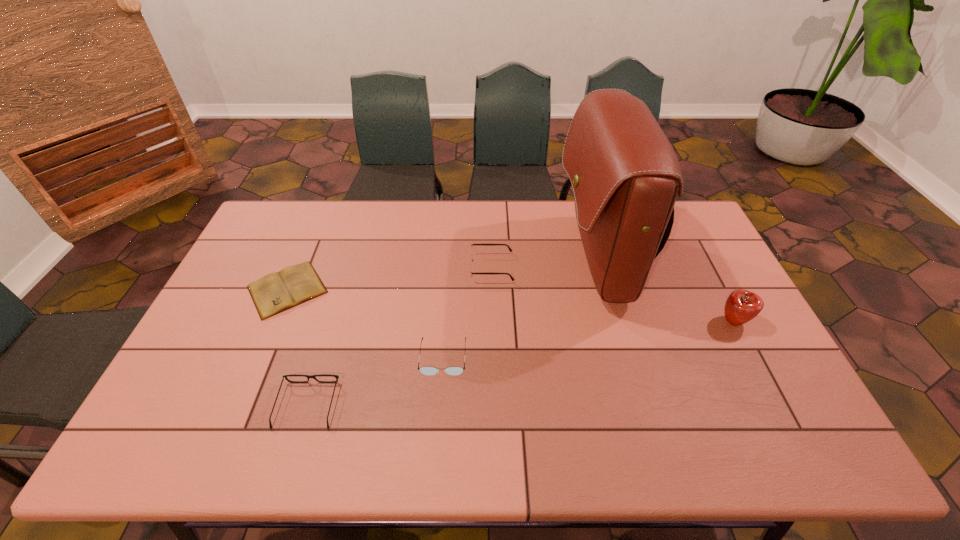
The width and height of the screenshot is (960, 540). I want to click on the shortest object, so click(x=293, y=285).

Image resolution: width=960 pixels, height=540 pixels. Identify the location of free space located 0.190m on the open flap of the tallest object. (501, 260).

At what (x,y) coordinates should I click in order to perform the action: click on free space located 0.150m on the open flap of the tallest object. Please return your answer as a coordinate pair (x, y). Looking at the image, I should click on (514, 260).

Where is `blank space located on the open flap of the tallest object`? This screenshot has width=960, height=540. blank space located on the open flap of the tallest object is located at coordinates (492, 260).

The width and height of the screenshot is (960, 540). Find the location of `vacant space situated 0.320m on the back of the apple`. vacant space situated 0.320m on the back of the apple is located at coordinates (691, 241).

The image size is (960, 540). What are the coordinates of `free space located 0.290m at the hinge ends of the third object from right to left` in the screenshot? It's located at (381, 268).

You are a GUI agent. You are given a task and a screenshot of the screen. Output one action in this format:
    pyautogui.click(x=<x>, y=<y>)
    Task: Click on the free location located at the hinge ends of the third object from right to left
    This screenshot has height=540, width=960.
    Given the screenshot: What is the action you would take?
    pyautogui.click(x=423, y=268)

You are a GUI agent. You are given a task and a screenshot of the screen. Output one action in this format:
    pyautogui.click(x=<x>, y=<y>)
    Task: Click on the vacant space located 0.330m at the hinge ends of the third object from right to left
    The height and width of the screenshot is (540, 960).
    Given the screenshot: What is the action you would take?
    (x=369, y=268)

This screenshot has height=540, width=960. In order to click on free location located on the lenses of the second nearest object in this screenshot , I will do `click(436, 455)`.

What are the coordinates of `vacant space located 0.330m on the front-facing side of the leftmost spectacles` in the screenshot? It's located at (342, 290).